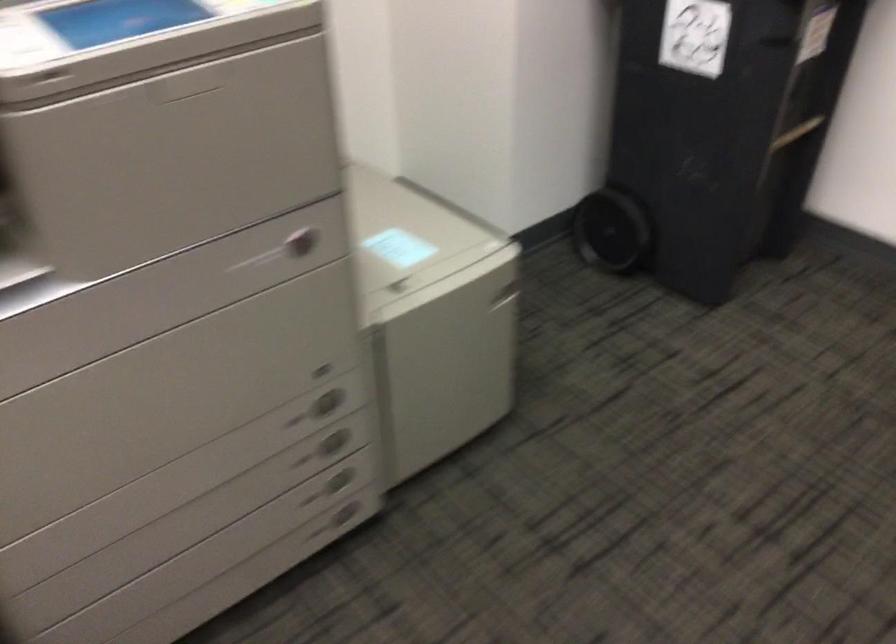
The image size is (896, 644). I want to click on red release button, so 300,242.